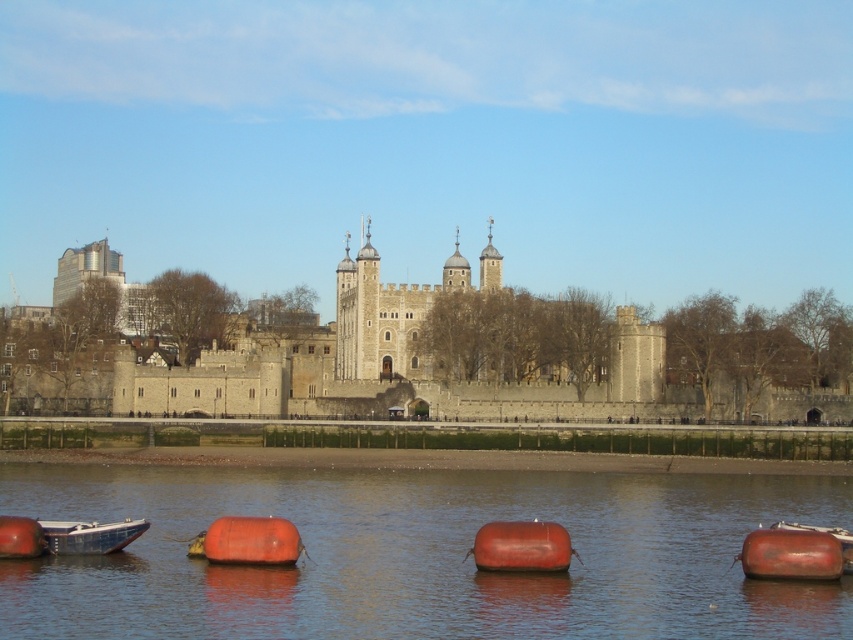
Which of these two, rubber matte buoy at lower center or metallic blue boat at lower left, stands taller?

rubber matte buoy at lower center is taller.

Between point (270, 536) and point (65, 529), which one is positioned behind?

The point (65, 529) is more distant.

Is point (231, 556) positioned behind point (76, 548)?

That is False.

Locate an element on the screen. rubber matte buoy at lower center is located at coordinates (248, 540).

Does point (688, 497) come farther from viewer compared to point (15, 532)?

Yes, point (688, 497) is farther from viewer.

At what (x,y) coordinates should I click in order to perform the action: click on smooth rubber buoys at lower center. Please return your answer as a coordinate pair (x, y). This screenshot has width=853, height=640. Looking at the image, I should click on (419, 556).

Which is behind, point (395, 506) or point (7, 524)?

Positioned behind is point (395, 506).

Locate an element on the screen. The height and width of the screenshot is (640, 853). smooth rubber buoys at lower center is located at coordinates (419, 556).

Can you confirm if stone castle at center is positioned below rubber orange buoy at lower center?

No, stone castle at center is not below rubber orange buoy at lower center.

This screenshot has height=640, width=853. Find the location of `stone castle at center`. stone castle at center is located at coordinates (476, 349).